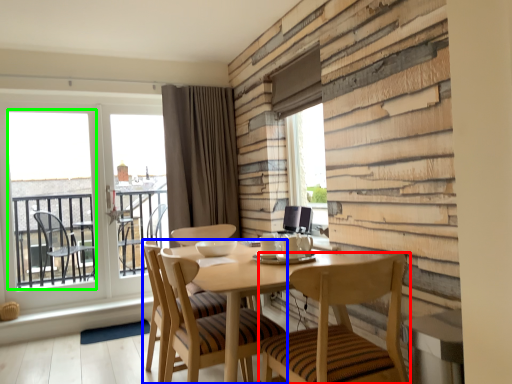
Question: Considering the real-world distances, which object is farthest from chair (highlighted by a red box)? chair (highlighted by a blue box) or window screen (highlighted by a green box)?

Choices:
 (A) chair
 (B) window screen

Answer: (B)